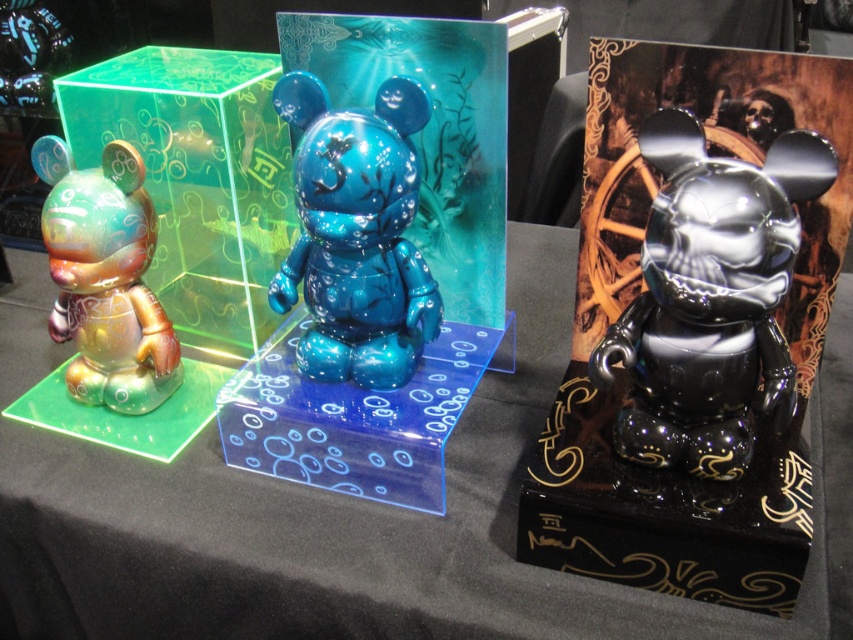
Is glossy blue bear at center shorter than translucent blue acrylic at center?

No.

Does glossy blue bear at center lie in front of translucent blue acrylic at center?

That is True.

Measure the distance between point (376, 170) and camera.

Point (376, 170) and camera are 38.74 inches apart from each other.

This screenshot has width=853, height=640. What are the coordinates of `glossy blue bear at center` in the screenshot? It's located at (357, 234).

Looking at this image, is translucent acrylic table at center thinner than glossy blue bear at center?

In fact, translucent acrylic table at center might be wider than glossy blue bear at center.

Is point (233, 582) farther from viewer compared to point (341, 372)?

No, it is in front of (341, 372).

You are a GUI agent. You are given a task and a screenshot of the screen. Output one action in this format:
    pyautogui.click(x=<x>, y=<y>)
    Task: Click on the translucent acrylic table at center
    The image size is (853, 640).
    Given the screenshot: What is the action you would take?
    pyautogui.click(x=372, y=524)

Based on the photo, how much distance is there between shiny black bear at right and translucent blue acrylic at center?

shiny black bear at right and translucent blue acrylic at center are 14.50 inches apart from each other.

Who is positioned more to the left, shiny black bear at right or translucent blue acrylic at center?

translucent blue acrylic at center

Is point (688, 273) closer to camera compared to point (287, 403)?

Yes, point (688, 273) is in front of point (287, 403).

The image size is (853, 640). I want to click on shiny black bear at right, so click(x=711, y=298).